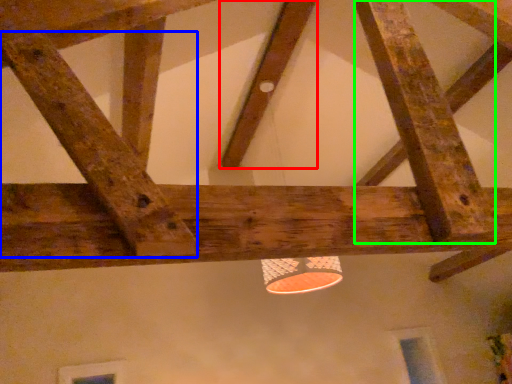
Question: Based on their relative distances, which object is nearer to plank (highlighted by a red box)? Choose from plank (highlighted by a blue box) and plank (highlighted by a green box).

Choices:
 (A) plank
 (B) plank

Answer: (B)